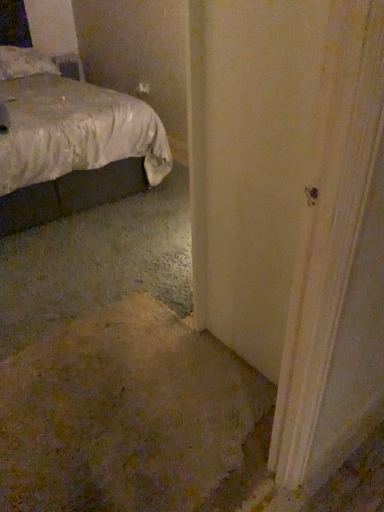
Question: Based on their sizes in the image, would you say white fabric bed at upper left is bigger or smaller than white fabric pillow at upper left?

Choices:
 (A) small
 (B) big

Answer: (B)

Question: In terms of height, does white fabric bed at upper left look taller or shorter compared to white fabric pillow at upper left?

Choices:
 (A) tall
 (B) short

Answer: (A)

Question: Looking at their shapes, would you say white fabric bed at upper left is wider or thinner than white fabric pillow at upper left?

Choices:
 (A) thin
 (B) wide

Answer: (B)

Question: From a real-world perspective, is white fabric pillow at upper left physically located above or below white fabric bed at upper left?

Choices:
 (A) below
 (B) above

Answer: (B)

Question: Looking at the image, does white fabric pillow at upper left seem bigger or smaller compared to white fabric bed at upper left?

Choices:
 (A) small
 (B) big

Answer: (A)

Question: Is point (11, 66) positioned closer to the camera than point (39, 181)?

Choices:
 (A) closer
 (B) farther

Answer: (B)

Question: Relative to white fabric bed at upper left, is white fabric pillow at upper left in front or behind?

Choices:
 (A) behind
 (B) front

Answer: (A)